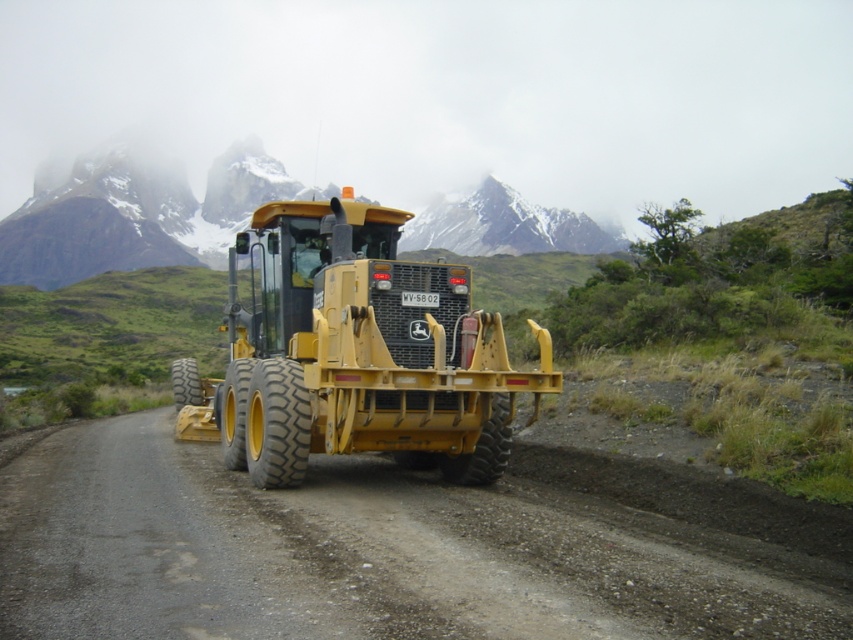
Is point (206, 579) less distant than point (126, 202)?

Yes, point (206, 579) is in front of point (126, 202).

Looking at this image, does dirt track at center appear under snowy rocky mountain at upper center?

Indeed, dirt track at center is positioned under snowy rocky mountain at upper center.

What do you see at coordinates (392, 550) in the screenshot? The image size is (853, 640). I see `dirt track at center` at bounding box center [392, 550].

The width and height of the screenshot is (853, 640). Find the location of `dirt track at center`. dirt track at center is located at coordinates (392, 550).

Is dirt track at center taller than metallic yellow tractor at center?

No.

Is dirt track at center shorter than metallic yellow tractor at center?

Yes, dirt track at center is shorter than metallic yellow tractor at center.

Where is `dirt track at center`? This screenshot has height=640, width=853. dirt track at center is located at coordinates (392, 550).

This screenshot has height=640, width=853. What do you see at coordinates (355, 353) in the screenshot?
I see `metallic yellow tractor at center` at bounding box center [355, 353].

Does metallic yellow tractor at center have a greater height compared to snowy rocky mountain at upper center?

No.

Between point (221, 426) and point (186, 253), which one is positioned behind?

The point (186, 253) is behind.

This screenshot has height=640, width=853. What are the coordinates of `metallic yellow tractor at center` in the screenshot? It's located at (355, 353).